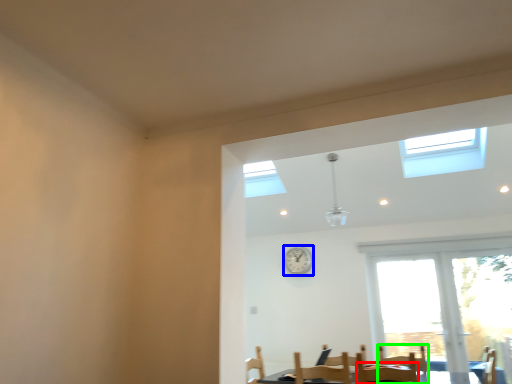
Question: Which is nearer to the chair (highlighted by a red box)? clock (highlighted by a blue box) or armchair (highlighted by a green box).

Choices:
 (A) clock
 (B) armchair

Answer: (B)